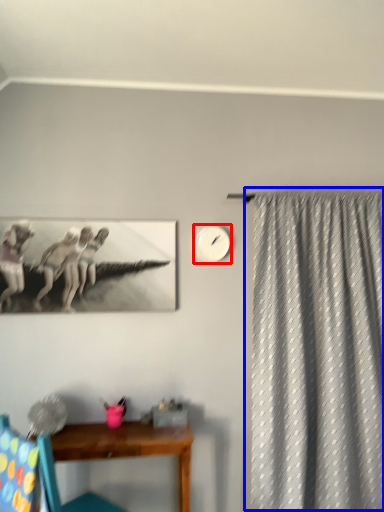
Question: Which object is further to the camera taking this photo, clock (highlighted by a red box) or curtain (highlighted by a blue box)?

Choices:
 (A) clock
 (B) curtain

Answer: (A)